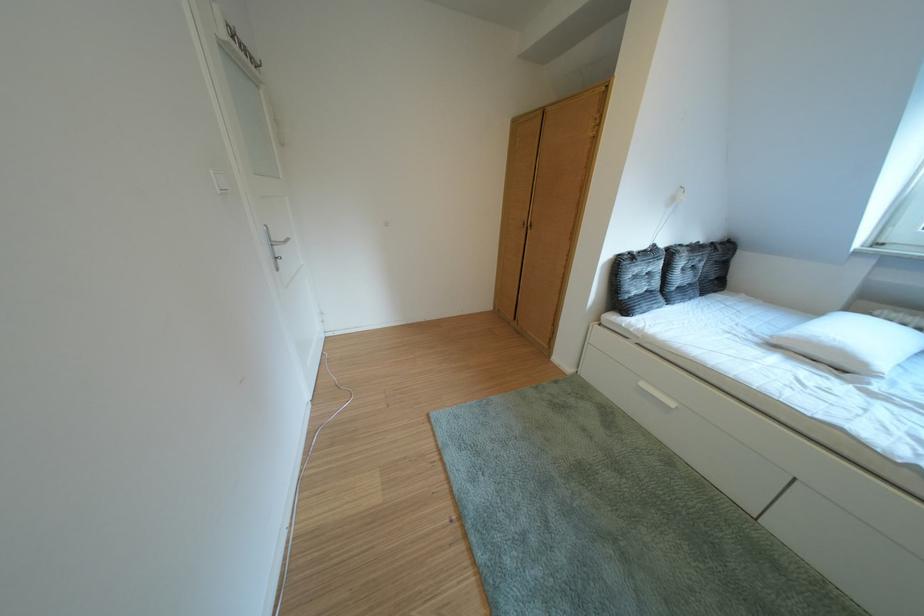
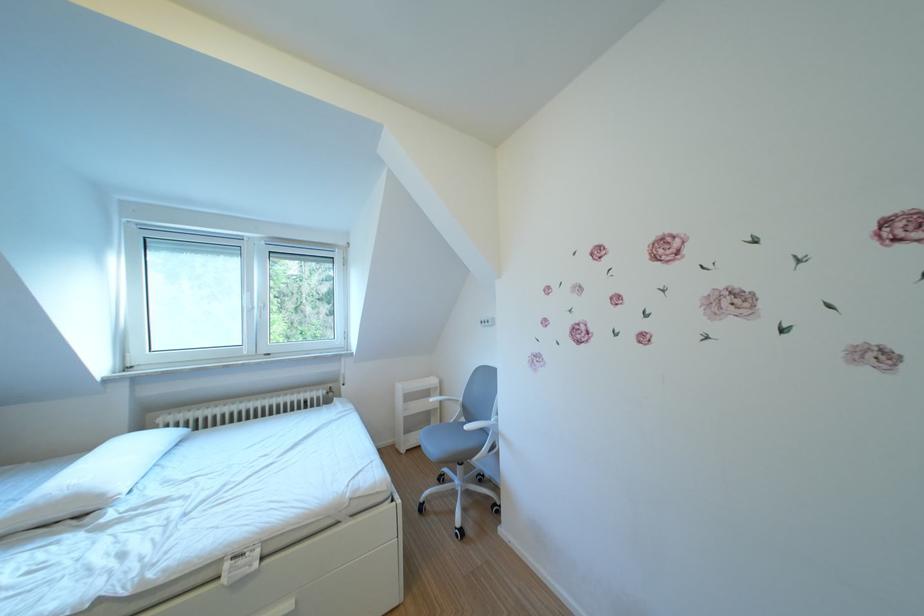
Find the pixel in the second image that matches (x=878, y=369) in the first image.

(115, 501)